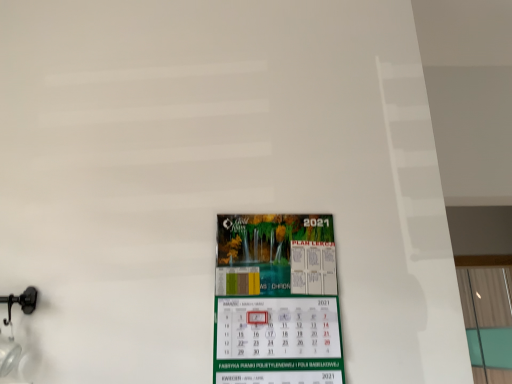
Question: Based on their sizes in the image, would you say green paper calendar at center is bigger or smaller than transparent glass window at right?

Choices:
 (A) small
 (B) big

Answer: (A)

Question: From a real-world perspective, is green paper calendar at center positioned above or below transparent glass window at right?

Choices:
 (A) above
 (B) below

Answer: (B)

Question: Do you think green paper calendar at center is within transparent glass window at right, or outside of it?

Choices:
 (A) outside
 (B) inside

Answer: (A)

Question: Considering the positions of point (471, 299) and point (242, 230), is point (471, 299) closer or farther from the camera than point (242, 230)?

Choices:
 (A) closer
 (B) farther

Answer: (B)

Question: From a real-world perspective, is transparent glass window at right above or below green paper calendar at center?

Choices:
 (A) above
 (B) below

Answer: (A)

Question: Considering the positions of transparent glass window at right and green paper calendar at center in the image, is transparent glass window at right wider or thinner than green paper calendar at center?

Choices:
 (A) thin
 (B) wide

Answer: (B)

Question: Do you think transparent glass window at right is within green paper calendar at center, or outside of it?

Choices:
 (A) inside
 (B) outside

Answer: (B)